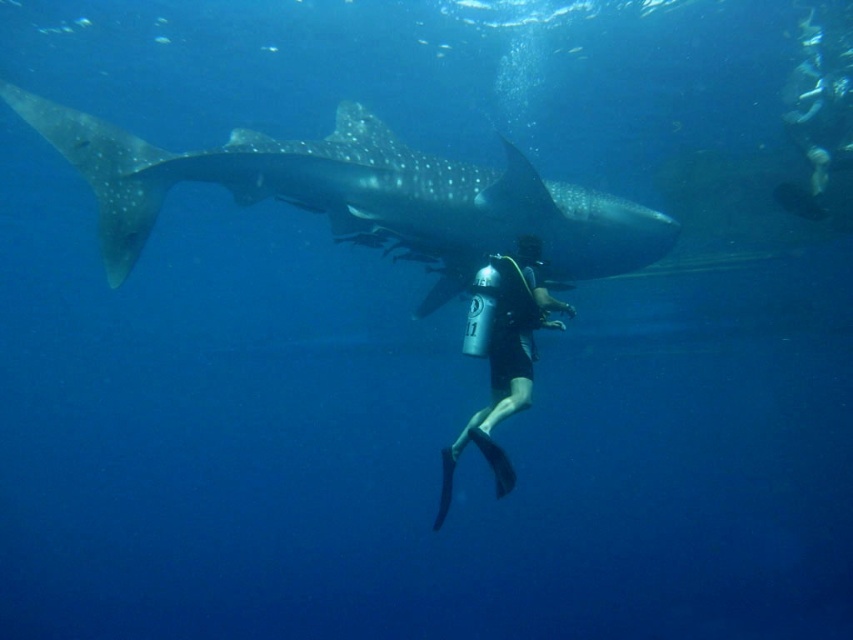
Question: Is speckled gray whale shark at upper center smaller than black matte scuba diver at center?

Choices:
 (A) no
 (B) yes

Answer: (A)

Question: Does speckled gray whale shark at upper center have a lesser width compared to black matte scuba diver at center?

Choices:
 (A) no
 (B) yes

Answer: (A)

Question: Which of the following is the farthest from the observer?

Choices:
 (A) black matte scuba diver at center
 (B) speckled gray whale shark at upper center

Answer: (B)

Question: Is speckled gray whale shark at upper center wider than black matte scuba diver at center?

Choices:
 (A) no
 (B) yes

Answer: (B)